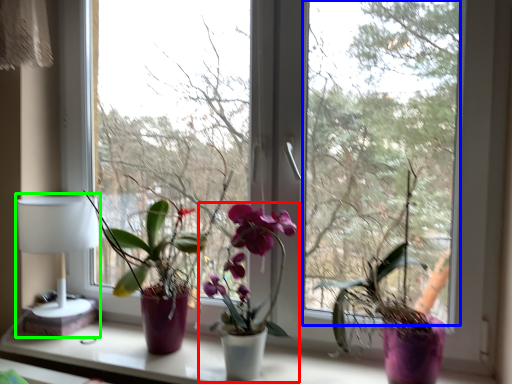
Question: Considering the real-world distances, which object is farthest from houseplant (highlighted by a red box)? window screen (highlighted by a blue box) or table lamp (highlighted by a green box)?

Choices:
 (A) window screen
 (B) table lamp

Answer: (A)